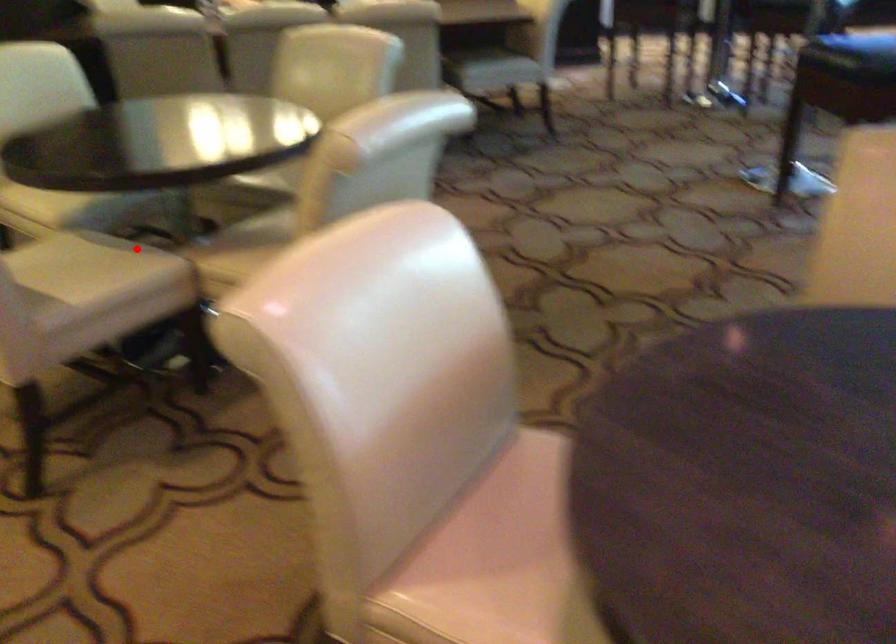
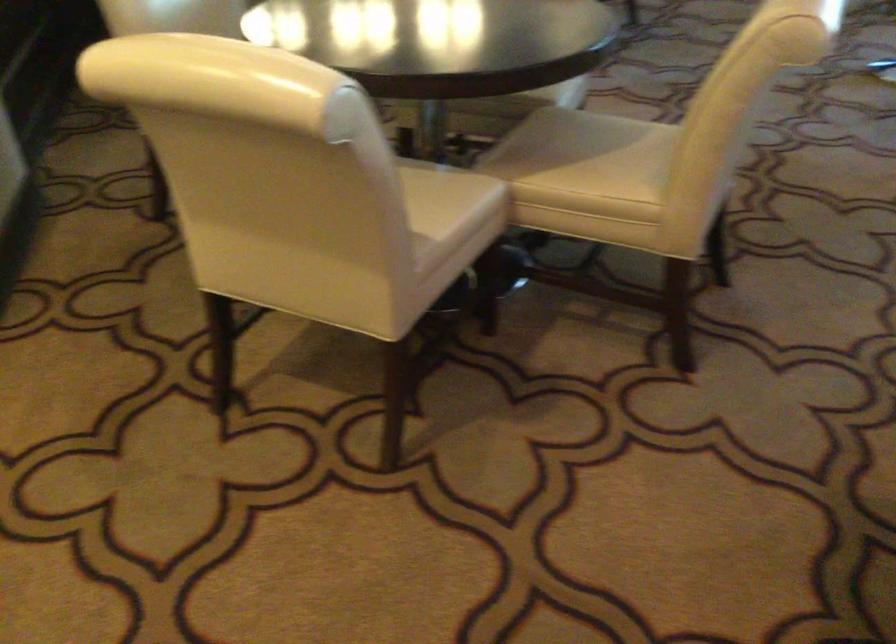
Find the pixel in the second image that matches the highlighted location in the first image.

(437, 167)